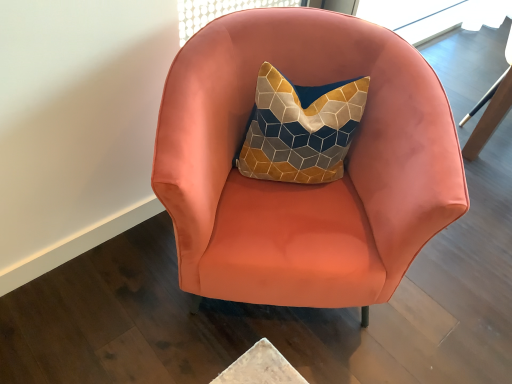
The width and height of the screenshot is (512, 384). I want to click on spots to the right of satin coral armchair at center, so click(x=452, y=294).